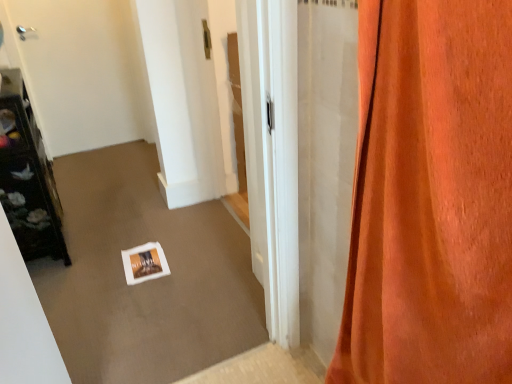
Question: Looking at the image, does orange velvet curtain at right seem bigger or smaller compared to dark brown wooden shelf at left?

Choices:
 (A) big
 (B) small

Answer: (B)

Question: Is point (470, 264) positioned closer to the camera than point (7, 135)?

Choices:
 (A) closer
 (B) farther

Answer: (A)

Question: Based on their relative distances, which object is farther from the white glossy door at upper left?

Choices:
 (A) dark brown wooden shelf at left
 (B) orange velvet curtain at right

Answer: (B)

Question: Which object is the closest to the white glossy door at upper left?

Choices:
 (A) orange velvet curtain at right
 (B) dark brown wooden shelf at left

Answer: (B)